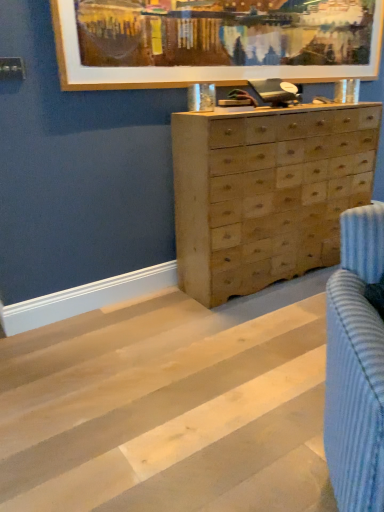
In order to face wooden frame at upper center, should I rotate leftwards or rightwards?

To face it directly, rotate right by 8.601 degrees.

Image resolution: width=384 pixels, height=512 pixels. Identify the location of natural wood floor at center. (166, 410).

Does natural wood chest of drawers at center have a lesser height compared to wooden frame at upper center?

Incorrect, the height of natural wood chest of drawers at center does not fall short of that of wooden frame at upper center.

Is natural wood chest of drawers at center closer to camera compared to wooden frame at upper center?

No, it is not.

Considering the relative positions of natural wood chest of drawers at center and wooden frame at upper center in the image provided, is natural wood chest of drawers at center to the left of wooden frame at upper center from the viewer's perspective?

In fact, natural wood chest of drawers at center is to the right of wooden frame at upper center.

From a real-world perspective, between natural wood chest of drawers at center and wooden frame at upper center, who is vertically higher?

wooden frame at upper center.

Considering the relative sizes of natural wood floor at center and wooden frame at upper center in the image provided, is natural wood floor at center smaller than wooden frame at upper center?

No.

Which object is closer to the camera taking this photo, natural wood floor at center or wooden frame at upper center?

natural wood floor at center is more forward.

Where is `stripe that is on the left side of wooden frame at upper center`? Image resolution: width=384 pixels, height=512 pixels. stripe that is on the left side of wooden frame at upper center is located at coordinates (166, 410).

Is natural wood floor at center at the left side of wooden frame at upper center?

Yes.

From a real-world perspective, is natural wood chest of drawers at center physically below natural wood floor at center?

No, from a real-world perspective, natural wood chest of drawers at center is not under natural wood floor at center.

Considering the relative sizes of natural wood chest of drawers at center and natural wood floor at center in the image provided, is natural wood chest of drawers at center thinner than natural wood floor at center?

Indeed, natural wood chest of drawers at center has a lesser width compared to natural wood floor at center.

Is natural wood chest of drawers at center next to natural wood floor at center and touching it?

natural wood chest of drawers at center and natural wood floor at center are clearly separated.

Which is in front, point (203, 189) or point (243, 395)?

The point (243, 395) is in front.

How much distance is there between natural wood floor at center and natural wood chest of drawers at center?

natural wood floor at center and natural wood chest of drawers at center are 29.60 inches apart from each other.

Is natural wood floor at center inside the boundaries of natural wood chest of drawers at center, or outside?

natural wood floor at center is outside natural wood chest of drawers at center.

Between natural wood floor at center and natural wood chest of drawers at center, which one has smaller width?

With smaller width is natural wood chest of drawers at center.

Is natural wood floor at center further to camera compared to natural wood chest of drawers at center?

No, it is not.

Looking at the image, does wooden frame at upper center seem bigger or smaller compared to natural wood chest of drawers at center?

Clearly, wooden frame at upper center is smaller in size than natural wood chest of drawers at center.

Is wooden frame at upper center not close to natural wood chest of drawers at center?

No.

How many degrees apart are the facing directions of wooden frame at upper center and natural wood chest of drawers at center?

wooden frame at upper center and natural wood chest of drawers at center are facing 0.034 degrees away from each other.

Which object is thinner, wooden frame at upper center or natural wood chest of drawers at center?

With smaller width is wooden frame at upper center.

Is wooden frame at upper center shorter than natural wood floor at center?

No, wooden frame at upper center is not shorter than natural wood floor at center.

From a real-world perspective, who is located higher, wooden frame at upper center or natural wood floor at center?

wooden frame at upper center.

Image resolution: width=384 pixels, height=512 pixels. What are the coordinates of `picture frame behind the natural wood floor at center` in the screenshot? It's located at (214, 41).

Locate an element on the screen. picture frame that appears in front of the natural wood chest of drawers at center is located at coordinates (214, 41).

Find the location of a particular element. The height and width of the screenshot is (512, 384). stripe located underneath the wooden frame at upper center (from a real-world perspective) is located at coordinates point(166,410).

Based on the photo, based on their spatial positions, is natural wood chest of drawers at center or wooden frame at upper center further from natural wood floor at center?

wooden frame at upper center is further to natural wood floor at center.

From the image, which object appears to be nearer to natural wood chest of drawers at center, wooden frame at upper center or natural wood floor at center?

wooden frame at upper center is closer to natural wood chest of drawers at center.

Which object lies further to the anchor point natural wood chest of drawers at center, natural wood floor at center or wooden frame at upper center?

Among the two, natural wood floor at center is located further to natural wood chest of drawers at center.

Looking at the image, which one is located closer to wooden frame at upper center, natural wood floor at center or natural wood chest of drawers at center?

Among the two, natural wood chest of drawers at center is located nearer to wooden frame at upper center.

Based on their spatial positions, is natural wood chest of drawers at center or natural wood floor at center further from wooden frame at upper center?

natural wood floor at center is positioned further to the anchor wooden frame at upper center.

Considering their positions, is wooden frame at upper center positioned further to natural wood floor at center than natural wood chest of drawers at center?

wooden frame at upper center is further to natural wood floor at center.

Find the location of a particular element. The height and width of the screenshot is (512, 384). the chest of drawers between wooden frame at upper center and natural wood floor at center vertically is located at coordinates (266, 192).